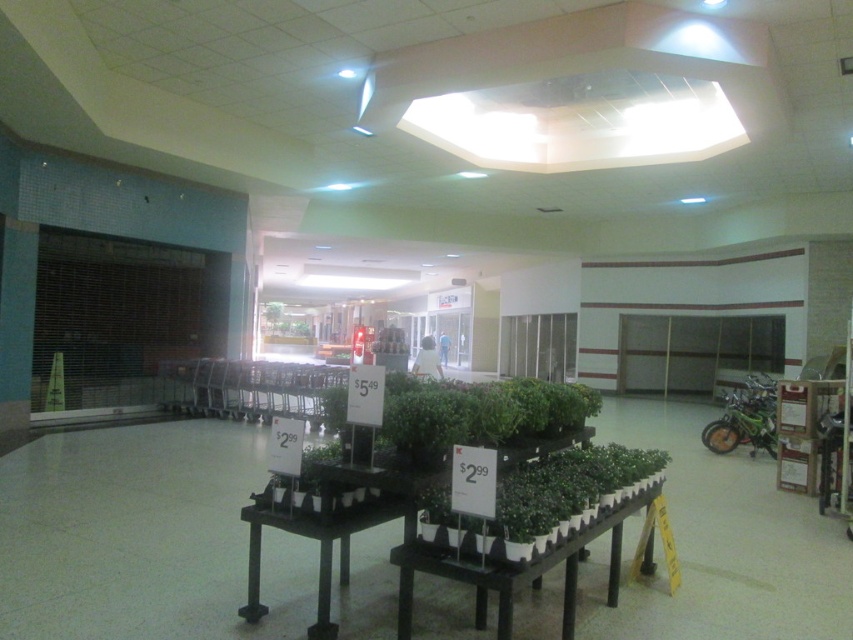
Question: Can you confirm if black matte table at center is positioned below black plastic table at center?

Choices:
 (A) no
 (B) yes

Answer: (B)

Question: Can you confirm if black matte table at center is bigger than black plastic table at center?

Choices:
 (A) no
 (B) yes

Answer: (B)

Question: Which of the following is the closest to the observer?

Choices:
 (A) black plastic table at center
 (B) black matte table at center

Answer: (B)

Question: Which point is closer to the camera?

Choices:
 (A) (277, 516)
 (B) (509, 612)

Answer: (B)

Question: Is black matte table at center below black plastic table at center?

Choices:
 (A) yes
 (B) no

Answer: (A)